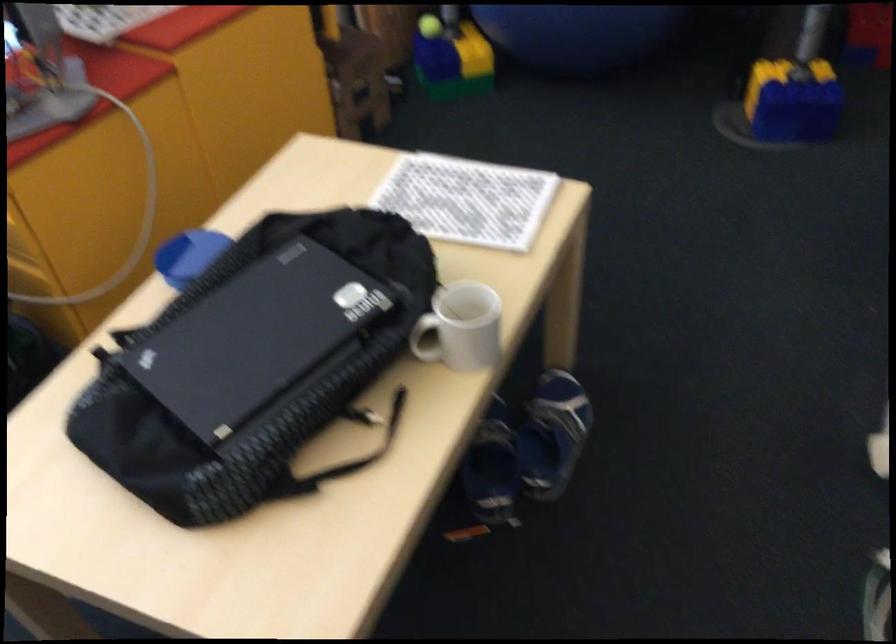
Where is `black laptop lid`? black laptop lid is located at coordinates (256, 337).